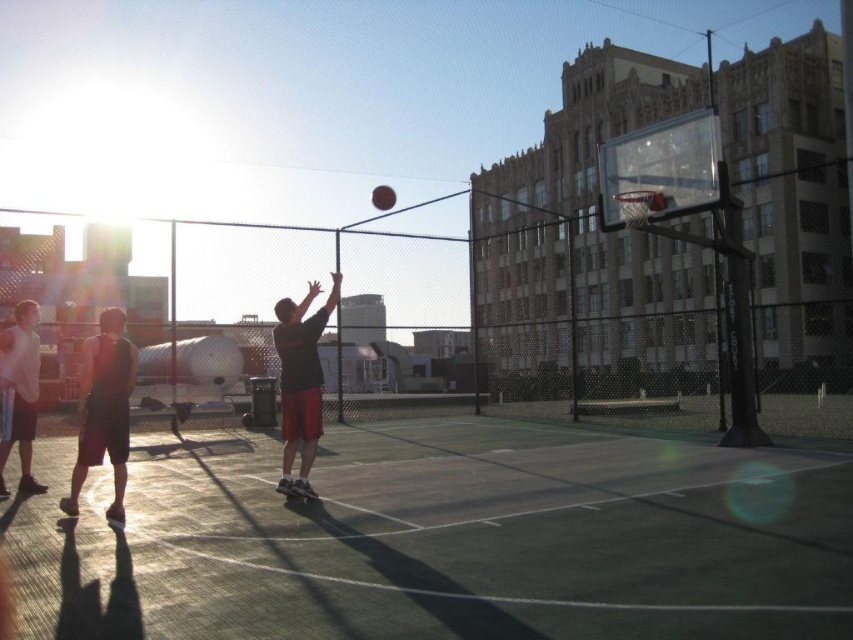
You are a photographer standing at the edge of the court. You want to take a picture of the green rubber court at center and the matte black shorts at left. Which object will appear larger in the photo?

The green rubber court at center will appear larger in the photo because it is closer to the viewer than the matte black shorts at left.

You are a basketball player standing on the green rubber court at center and looking towards the hoop. Where do you see the matte black shorts at left in relation to your position?

The matte black shorts at left are above the green rubber court at center, so you would see them positioned higher up relative to your standing position on the court.